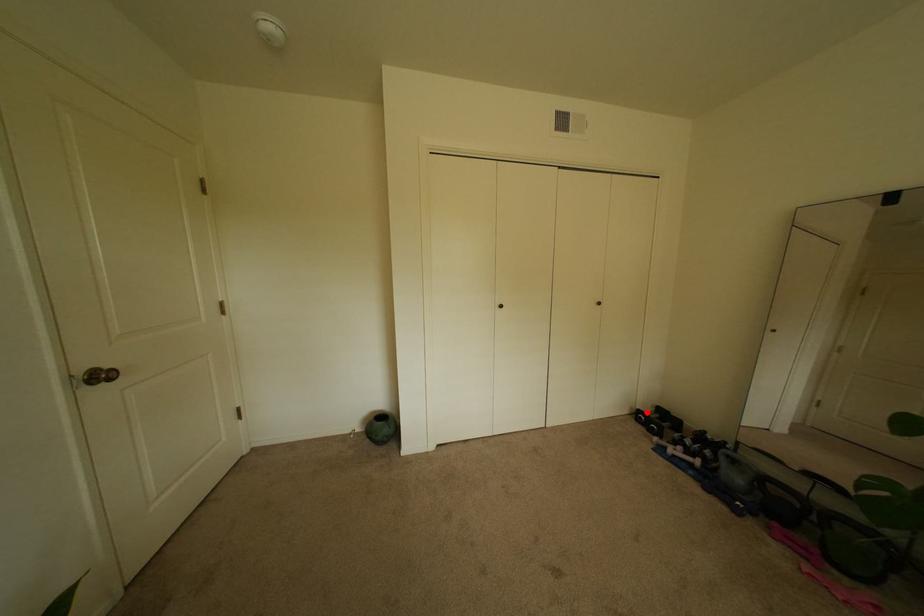
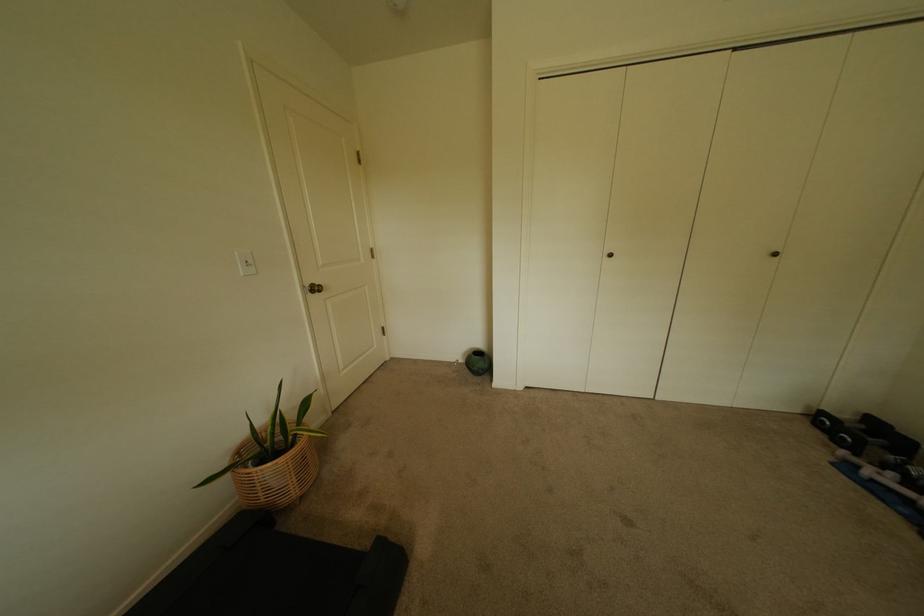
The point at the highlighted location is marked in the first image. Where is the corresponding point in the second image?

(831, 415)